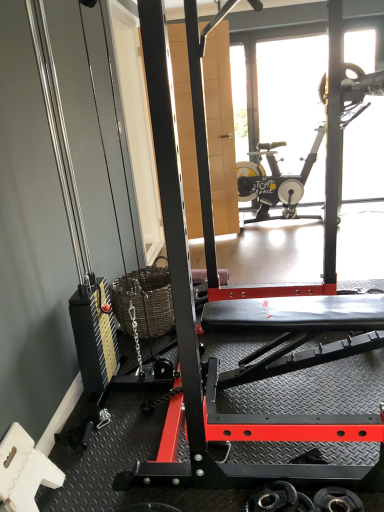
Question: Considering the relative sizes of black rubber weight at lower right, the 2th wheel viewed from the left, and transparent glass door at upper center in the image provided, is black rubber weight at lower right, the 2th wheel viewed from the left, smaller than transparent glass door at upper center?

Choices:
 (A) yes
 (B) no

Answer: (A)

Question: Is black rubber weight at lower right, the 2th wheel viewed from the left, directly adjacent to transparent glass door at upper center?

Choices:
 (A) yes
 (B) no

Answer: (B)

Question: From a real-world perspective, is black rubber weight at lower right, arranged as the first wheel when viewed from the right, over transparent glass door at upper center?

Choices:
 (A) yes
 (B) no

Answer: (B)

Question: Is transparent glass door at upper center at the back of black rubber weight at lower right, the 2th wheel viewed from the left?

Choices:
 (A) no
 (B) yes

Answer: (A)

Question: Considering the relative positions of black rubber weight at lower right, arranged as the first wheel when viewed from the right, and transparent glass door at upper center in the image provided, is black rubber weight at lower right, arranged as the first wheel when viewed from the right, behind transparent glass door at upper center?

Choices:
 (A) yes
 (B) no

Answer: (B)

Question: From the image's perspective, relative to transparent glass door at upper center, is black rubber weight at lower right, arranged as the first wheel when viewed from the right, above or below?

Choices:
 (A) above
 (B) below

Answer: (B)

Question: Considering the positions of point (336, 490) and point (317, 84), is point (336, 490) closer or farther from the camera than point (317, 84)?

Choices:
 (A) farther
 (B) closer

Answer: (B)

Question: From a real-world perspective, is black rubber weight at lower right, the 2th wheel viewed from the left, positioned above or below transparent glass door at upper center?

Choices:
 (A) above
 (B) below

Answer: (B)

Question: Would you say black rubber weight at lower right, arranged as the first wheel when viewed from the right, is inside or outside transparent glass door at upper center?

Choices:
 (A) inside
 (B) outside

Answer: (B)

Question: Would you say metallic black weight at lower center, the 2th wheel in the right-to-left sequence, is to the left or to the right of black rubber weight at lower right, arranged as the first wheel when viewed from the right, in the picture?

Choices:
 (A) right
 (B) left

Answer: (B)

Question: In the image, is metallic black weight at lower center, the 2th wheel in the right-to-left sequence, positioned in front of or behind black rubber weight at lower right, the 2th wheel viewed from the left?

Choices:
 (A) front
 (B) behind

Answer: (A)

Question: From the image's perspective, is metallic black weight at lower center, the 2th wheel in the right-to-left sequence, above or below black rubber weight at lower right, arranged as the first wheel when viewed from the right?

Choices:
 (A) below
 (B) above

Answer: (A)

Question: Does point (279, 480) appear closer or farther from the camera than point (322, 500)?

Choices:
 (A) closer
 (B) farther

Answer: (B)

Question: From the image's perspective, relative to metallic black weight at lower center, acting as the 1th wheel starting from the left, is transparent glass door at upper center above or below?

Choices:
 (A) below
 (B) above

Answer: (B)

Question: Looking at the image, does transparent glass door at upper center seem bigger or smaller compared to metallic black weight at lower center, acting as the 1th wheel starting from the left?

Choices:
 (A) small
 (B) big

Answer: (B)